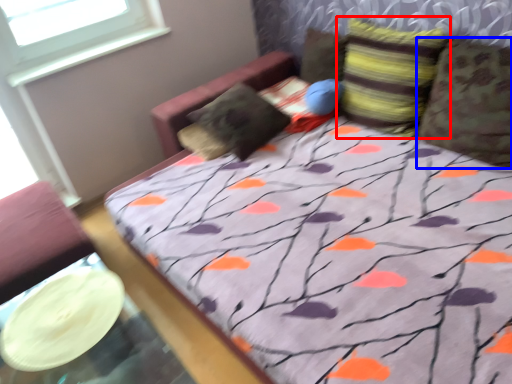
Question: Which object appears farthest to the camera in this image, pillow (highlighted by a red box) or pillow (highlighted by a blue box)?

Choices:
 (A) pillow
 (B) pillow

Answer: (A)